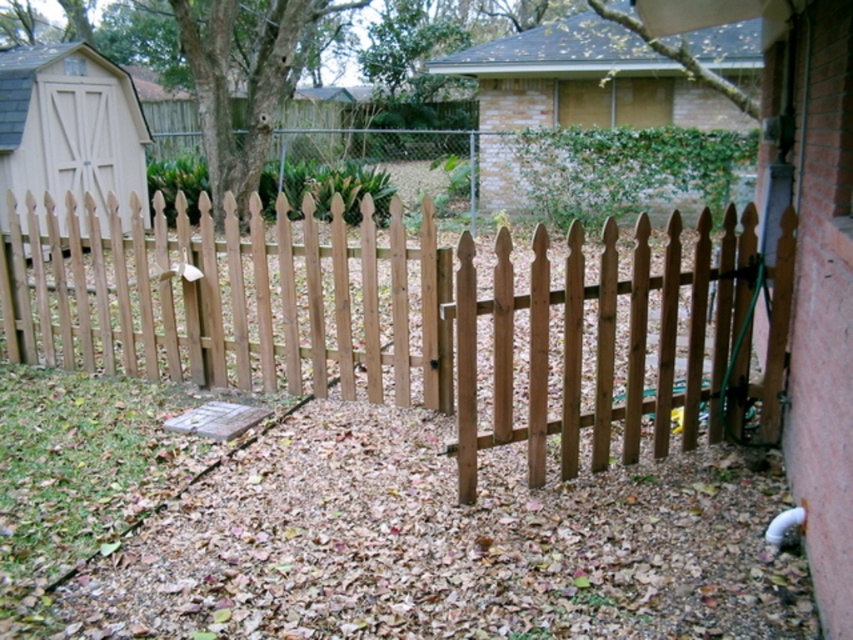
Is light brown wood picket fence at center smaller than light brown wood shed at left?

Actually, light brown wood picket fence at center might be larger than light brown wood shed at left.

Is light brown wood picket fence at center bigger than light brown wood shed at left?

Indeed, light brown wood picket fence at center has a larger size compared to light brown wood shed at left.

What do you see at coordinates (405, 317) in the screenshot? The width and height of the screenshot is (853, 640). I see `light brown wood picket fence at center` at bounding box center [405, 317].

Identify the location of light brown wood picket fence at center. This screenshot has height=640, width=853. coord(405,317).